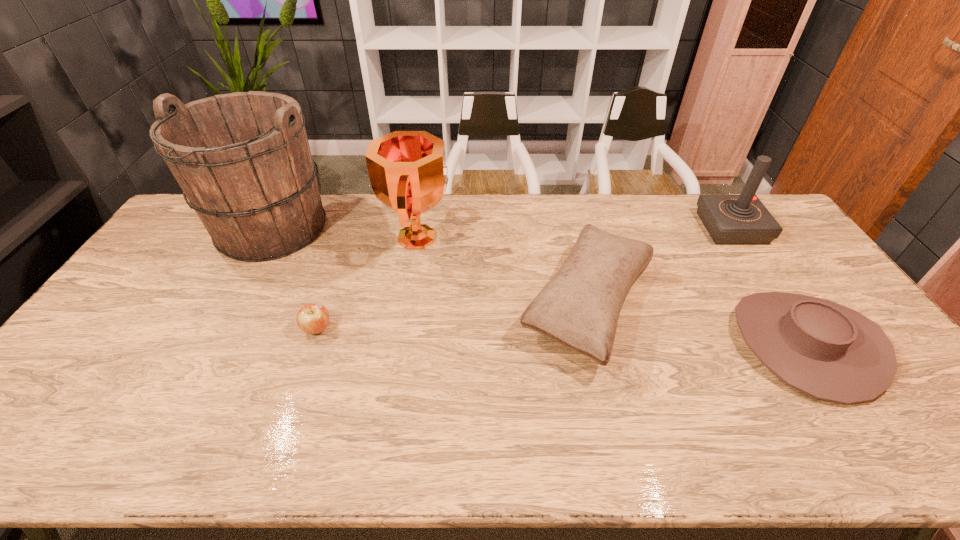
Find the location of a particular element. vacant area that lies between the cowboy hat and the third object from right to left is located at coordinates (697, 324).

Find the location of a particular element. Image resolution: width=960 pixels, height=540 pixels. free space between the third tallest object and the award is located at coordinates (575, 233).

Image resolution: width=960 pixels, height=540 pixels. I want to click on vacant point located between the joystick and the award, so point(575,233).

This screenshot has height=540, width=960. In order to click on empty location between the fourth tallest object and the apple in this screenshot , I will do `click(452, 317)`.

Where is `vacant point located between the fourth object from right to left and the fourth shortest object`? vacant point located between the fourth object from right to left and the fourth shortest object is located at coordinates (575, 233).

This screenshot has width=960, height=540. I want to click on vacant point located between the bucket and the cushion, so click(428, 268).

This screenshot has width=960, height=540. Identify the location of free spot between the leftmost object and the second shortest object. (538, 287).

The height and width of the screenshot is (540, 960). I want to click on empty space that is in between the fifth tallest object and the cushion, so click(697, 324).

You are a GUI agent. You are given a task and a screenshot of the screen. Output one action in this format:
    pyautogui.click(x=<x>, y=<y>)
    Task: Click on the vacant point located between the leftmost object and the cushion
    
    Given the screenshot: What is the action you would take?
    pyautogui.click(x=428, y=268)

Where is `vacant space that is in between the fifth object from right to left and the third object from left to right`? vacant space that is in between the fifth object from right to left and the third object from left to right is located at coordinates (368, 284).